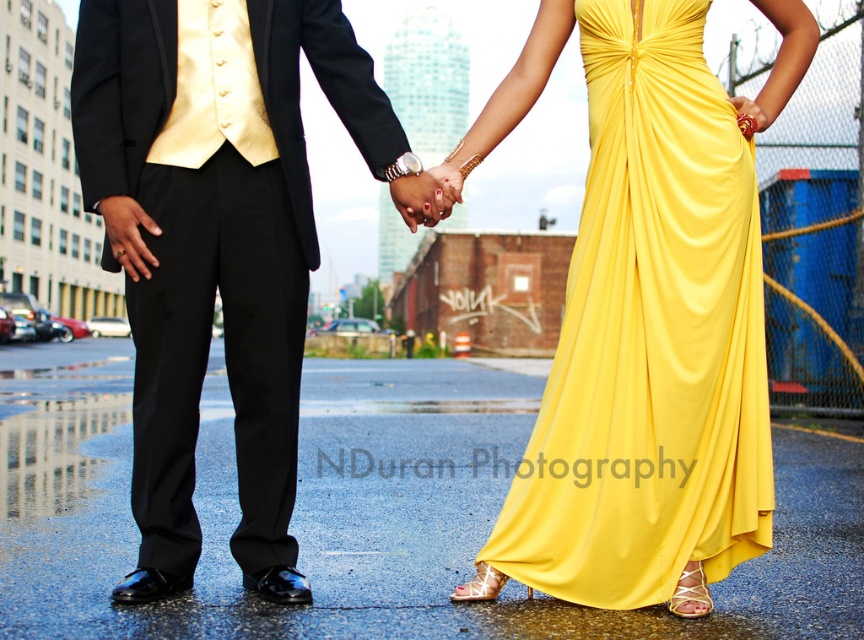
You are an interior designer planning to place a new sofa in a room. The sofa must be positioned such that it aligns with the coordinates of the satin yellow dress at center. What are the coordinates where you should place the sofa?

The coordinates for the satin yellow dress at center are at point [649,340]. Therefore, the sofa should be placed at coordinates [649,340] to align with it.

You are a photographer setting up for a formal event. You need to position two subjects so that their outfits are clearly visible in the photo. The subjects are wearing the satin yellow dress at center and the shiny black suit at center. Given that your camera has a minimum focus distance of 1.2 meters, will you be able to capture both outfits in focus without moving the subjects?

The satin yellow dress at center and the shiny black suit at center are 1.08 meters apart, which is less than the camera minimum focus distance of 1.2 meters. Therefore, the camera may not be able to capture both outfits in focus without moving the subjects closer together or adjusting the camera settings.